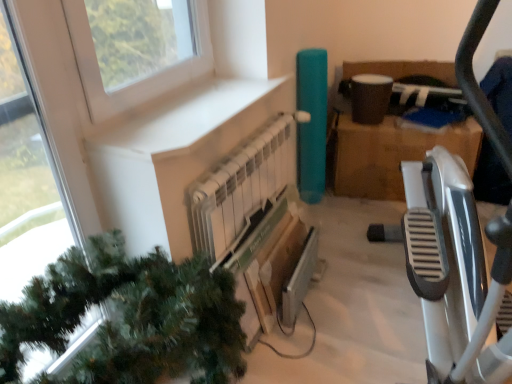
Where is `brown cardboard box at center-right`? The width and height of the screenshot is (512, 384). brown cardboard box at center-right is located at coordinates (392, 154).

What do you see at coordinates (298, 279) in the screenshot? I see `metallic silver tv at center` at bounding box center [298, 279].

Measure the distance between white matte window sill at upper left and camera.

4.49 feet.

Image resolution: width=512 pixels, height=384 pixels. I want to click on brown cardboard box at center-right, so click(392, 154).

You are a GUI agent. You are given a task and a screenshot of the screen. Output one action in this format:
    pyautogui.click(x=<x>, y=<y>)
    Task: Click on the christmas tree that is on the left side of white matte window sill at upper left
    The image size is (512, 384).
    Given the screenshot: What is the action you would take?
    pyautogui.click(x=129, y=317)

Is white matte window sill at upper left turned away from green matte christmas tree at lower left?

That's not correct — white matte window sill at upper left is not looking away from green matte christmas tree at lower left.

What's the angular difference between white matte window sill at upper left and green matte christmas tree at lower left's facing directions?

The facing directions of white matte window sill at upper left and green matte christmas tree at lower left are 1.2 degrees apart.

Can you see white matte window sill at upper left touching green matte christmas tree at lower left?

There is a gap between white matte window sill at upper left and green matte christmas tree at lower left.

Would you say green matte christmas tree at lower left is a long distance from white metallic radiator at center?

No, green matte christmas tree at lower left is not far from white metallic radiator at center.

Is green matte christmas tree at lower left positioned with its back to white metallic radiator at center?

green matte christmas tree at lower left is not turned away from white metallic radiator at center.

Which is behind, green matte christmas tree at lower left or white metallic radiator at center?

white metallic radiator at center is further from the camera.

Based on the photo, could you tell me if green matte christmas tree at lower left is facing white matte window sill at upper left?

No, green matte christmas tree at lower left is not facing towards white matte window sill at upper left.

Who is bigger, green matte christmas tree at lower left or white matte window sill at upper left?

Bigger between the two is green matte christmas tree at lower left.

Would you consider green matte christmas tree at lower left to be distant from white matte window sill at upper left?

No, there isn't a large distance between green matte christmas tree at lower left and white matte window sill at upper left.

Is white matte window sill at upper left completely or partially inside green matte christmas tree at lower left?

No, white matte window sill at upper left is located outside of green matte christmas tree at lower left.

Between transparent glass window at upper left and metallic silver tv at center, which one appears on the right side from the viewer's perspective?

metallic silver tv at center is more to the right.

Is metallic silver tv at center a part of transparent glass window at upper left?

No, metallic silver tv at center is not a part of transparent glass window at upper left.

Does transparent glass window at upper left have a lesser width compared to metallic silver tv at center?

Correct, the width of transparent glass window at upper left is less than that of metallic silver tv at center.

Considering the relative sizes of transparent glass window at upper left and metallic silver tv at center in the image provided, is transparent glass window at upper left shorter than metallic silver tv at center?

No, transparent glass window at upper left is not shorter than metallic silver tv at center.

Can you tell me how much white metallic radiator at center and green matte christmas tree at lower left differ in facing direction?

1.88 degrees separate the facing orientations of white metallic radiator at center and green matte christmas tree at lower left.

Is the position of white metallic radiator at center more distant than that of green matte christmas tree at lower left?

Yes, it is.

From a real-world perspective, is white metallic radiator at center positioned above or below green matte christmas tree at lower left?

In terms of real-world spatial position, white metallic radiator at center is above green matte christmas tree at lower left.

Consider the image. Is brown cardboard box at center-right bigger than transparent glass window at upper left?

Yes.

Is the surface of brown cardboard box at center-right in direct contact with transparent glass window at upper left?

brown cardboard box at center-right is not next to transparent glass window at upper left, and they're not touching.

Considering the sizes of objects brown cardboard box at center-right and transparent glass window at upper left in the image provided, who is taller, brown cardboard box at center-right or transparent glass window at upper left?

transparent glass window at upper left is taller.

From the image's perspective, is brown cardboard box at center-right beneath transparent glass window at upper left?

No, from the image's perspective, brown cardboard box at center-right is not beneath transparent glass window at upper left.

Based on the photo, is the position of brown cardboard box at center-right more distant than that of white matte window sill at upper left?

Yes, brown cardboard box at center-right is behind white matte window sill at upper left.

Between brown cardboard box at center-right and white matte window sill at upper left, which one has smaller width?

white matte window sill at upper left.

Could white matte window sill at upper left be considered to be inside brown cardboard box at center-right?

That's incorrect, white matte window sill at upper left is not inside brown cardboard box at center-right.

Identify the location of cardboard box that is above the white matte window sill at upper left (from the image's perspective). This screenshot has width=512, height=384. (392, 154).

This screenshot has width=512, height=384. I want to click on christmas tree located in front of the white matte window sill at upper left, so click(129, 317).

Identify the location of radiator above the green matte christmas tree at lower left (from a real-world perspective). The image size is (512, 384). (243, 194).

When comparing their distances from green matte christmas tree at lower left, does brown cardboard box at center-right or metallic silver tv at center seem closer?

The object closer to green matte christmas tree at lower left is metallic silver tv at center.

From the image, which object appears to be farther from transparent glass window at upper left, white matte window sill at upper left or brown cardboard box at center-right?

brown cardboard box at center-right is further to transparent glass window at upper left.

When comparing their distances from white matte window sill at upper left, does white metallic radiator at center or green matte christmas tree at lower left seem further?

Based on the image, green matte christmas tree at lower left appears to be further to white matte window sill at upper left.

When comparing their distances from green matte christmas tree at lower left, does white matte window sill at upper left or white metallic radiator at center seem closer?

white metallic radiator at center is positioned closer to the anchor green matte christmas tree at lower left.

Considering their positions, is white metallic radiator at center positioned closer to metallic silver tv at center than brown cardboard box at center-right?

Among the two, white metallic radiator at center is located nearer to metallic silver tv at center.

Looking at the image, which one is located closer to white matte window sill at upper left, green matte christmas tree at lower left or metallic silver tv at center?

green matte christmas tree at lower left is closer to white matte window sill at upper left.

Looking at this image, looking at the image, which one is located closer to white metallic radiator at center, transparent glass window at upper left or white matte window sill at upper left?

Among the two, white matte window sill at upper left is located nearer to white metallic radiator at center.

Considering their positions, is metallic silver tv at center positioned further to white matte window sill at upper left than green matte christmas tree at lower left?

metallic silver tv at center is further to white matte window sill at upper left.

Where is `window sill between green matte christmas tree at lower left and brown cardboard box at center-right along the z-axis`? window sill between green matte christmas tree at lower left and brown cardboard box at center-right along the z-axis is located at coordinates (183, 119).

Identify the location of appliance situated between white matte window sill at upper left and brown cardboard box at center-right from left to right. The height and width of the screenshot is (384, 512). pyautogui.click(x=298, y=279).

Where is `window positioned between green matte christmas tree at lower left and white metallic radiator at center from near to far`? This screenshot has width=512, height=384. window positioned between green matte christmas tree at lower left and white metallic radiator at center from near to far is located at coordinates (27, 177).

Where is `window sill between transparent glass window at upper left and white metallic radiator at center from left to right`? The height and width of the screenshot is (384, 512). window sill between transparent glass window at upper left and white metallic radiator at center from left to right is located at coordinates (183, 119).